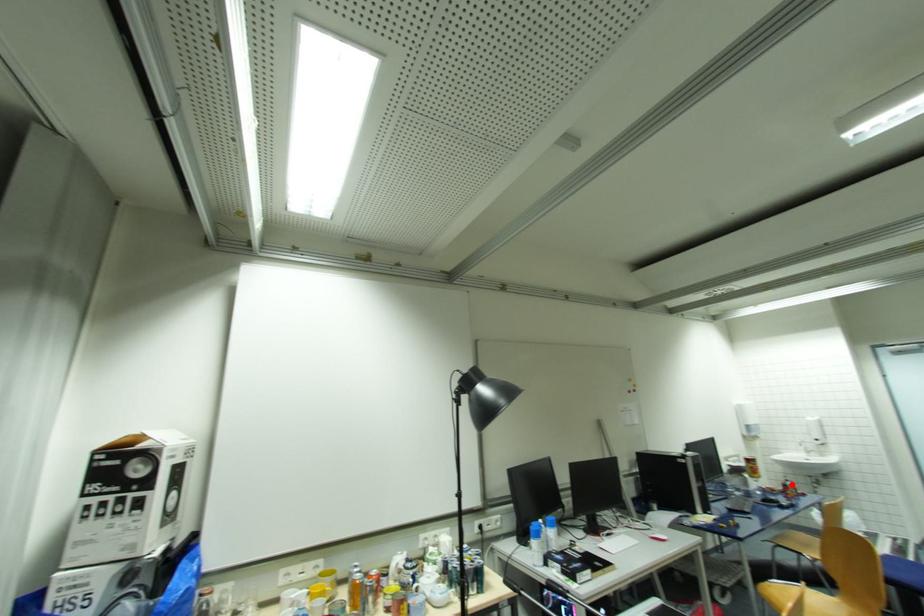
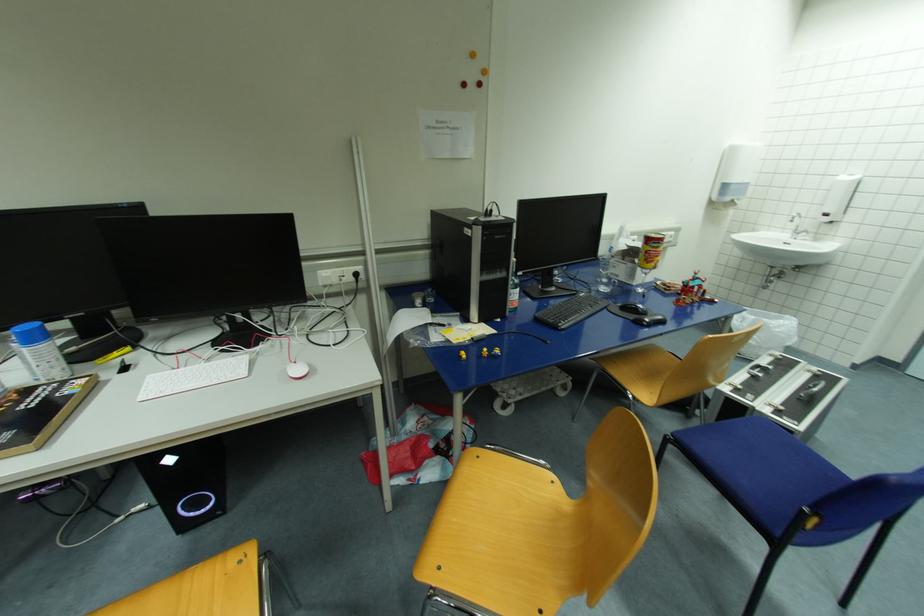
The point at the highlighted location is marked in the first image. Where is the corresponding point in the second image?

(696, 285)